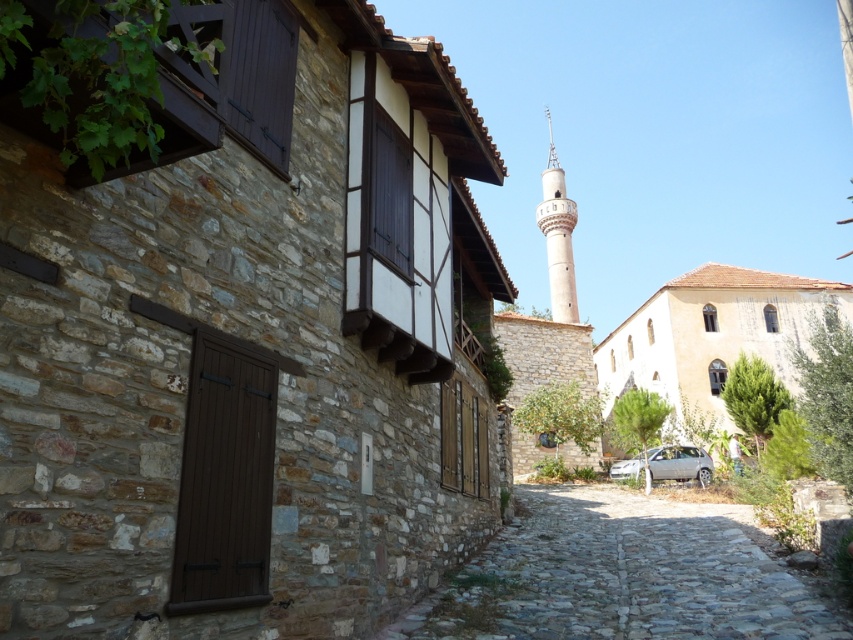
Consider the image. You are standing on the cobblestone street and want to determine the relative positions of two points marked in the scene. Which point, point (729, 621) or point (666, 448), is closer to you?

Point (729, 621) is closer to the viewer than point (666, 448).